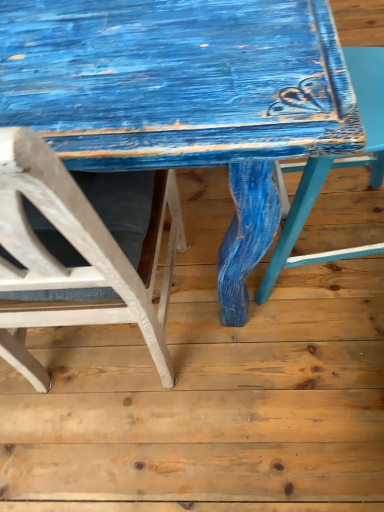
Question: Is distressed blue wood table at center to the left or to the right of white matte chair at left, placed as the first chair when sorted from left to right, in the image?

Choices:
 (A) left
 (B) right

Answer: (B)

Question: Is point (246, 76) positioned closer to the camera than point (13, 198)?

Choices:
 (A) farther
 (B) closer

Answer: (A)

Question: Based on their relative distances, which object is nearer to the white matte chair at left, placed as the second chair when sorted from right to left?

Choices:
 (A) distressed blue wood table at center
 (B) matte blue chair at right, which is the first chair in right-to-left order

Answer: (A)

Question: Estimate the real-world distances between objects in this image. Which object is closer to the distressed blue wood table at center?

Choices:
 (A) white matte chair at left, placed as the second chair when sorted from right to left
 (B) matte blue chair at right, which is the 2th chair from left to right

Answer: (A)